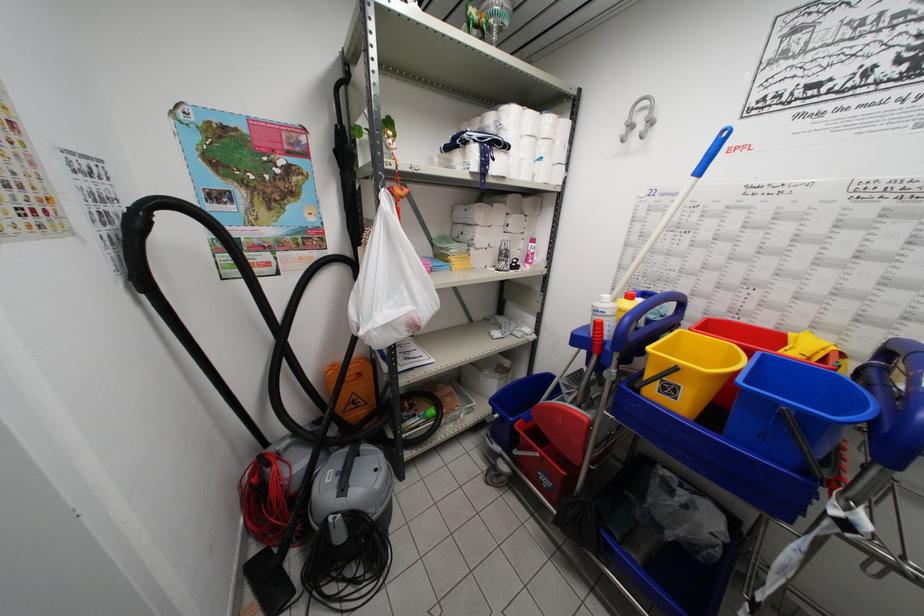
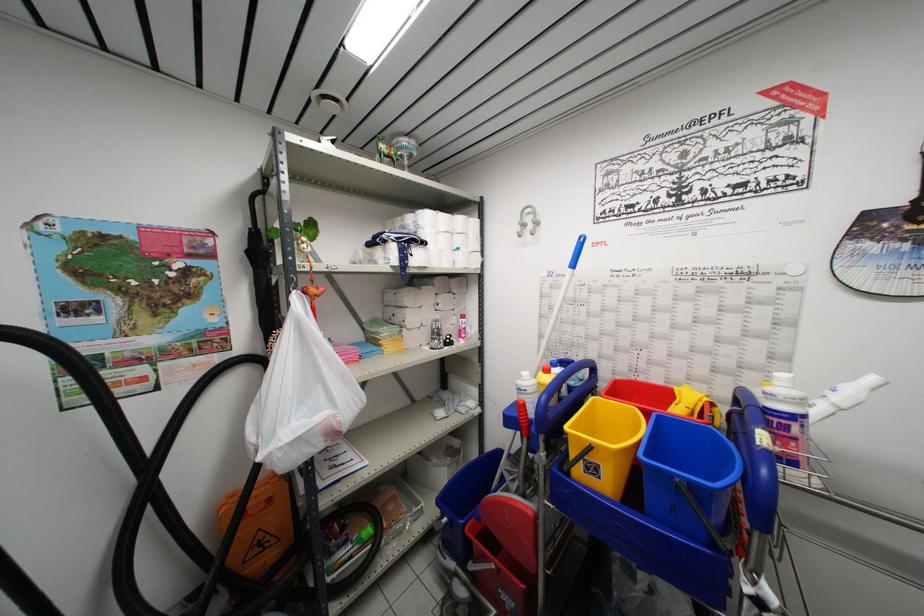
Locate, in the second image, the point that corresponds to point 726,136 in the first image.

(584, 241)